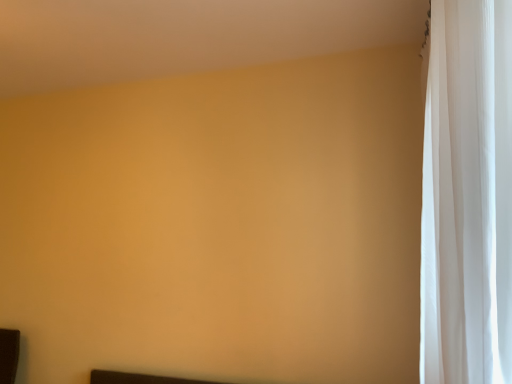
Image resolution: width=512 pixels, height=384 pixels. What do you see at coordinates (467, 195) in the screenshot?
I see `white sheer curtain at right` at bounding box center [467, 195].

Measure the distance between point (508, 155) and camera.

The depth of point (508, 155) is 28.70 inches.

Find the location of `white sheer curtain at right`. white sheer curtain at right is located at coordinates (467, 195).

Where is `white sheer curtain at right`? white sheer curtain at right is located at coordinates (467, 195).